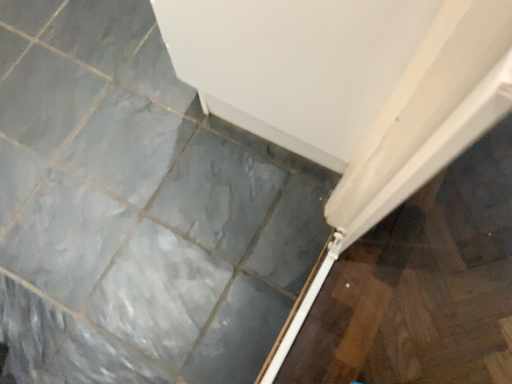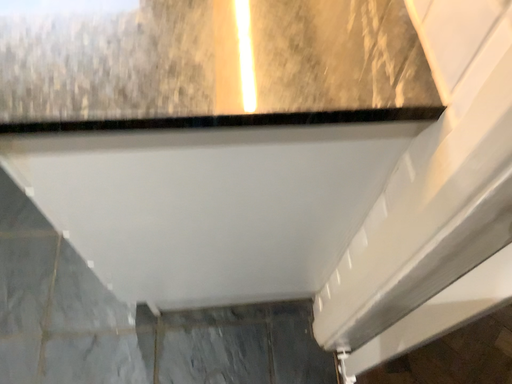
Question: Which way did the camera rotate in the video?

Choices:
 (A) rotated right
 (B) rotated left

Answer: (A)